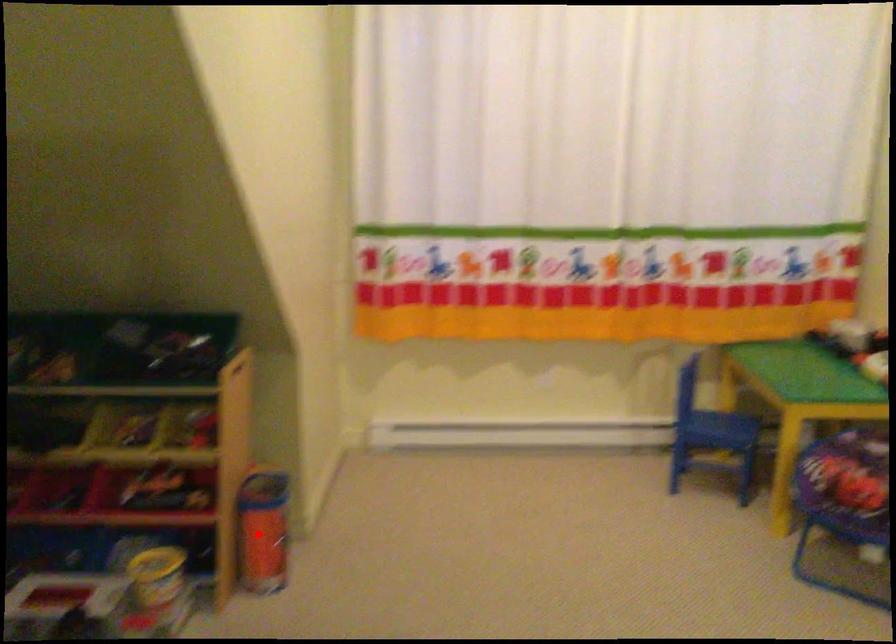
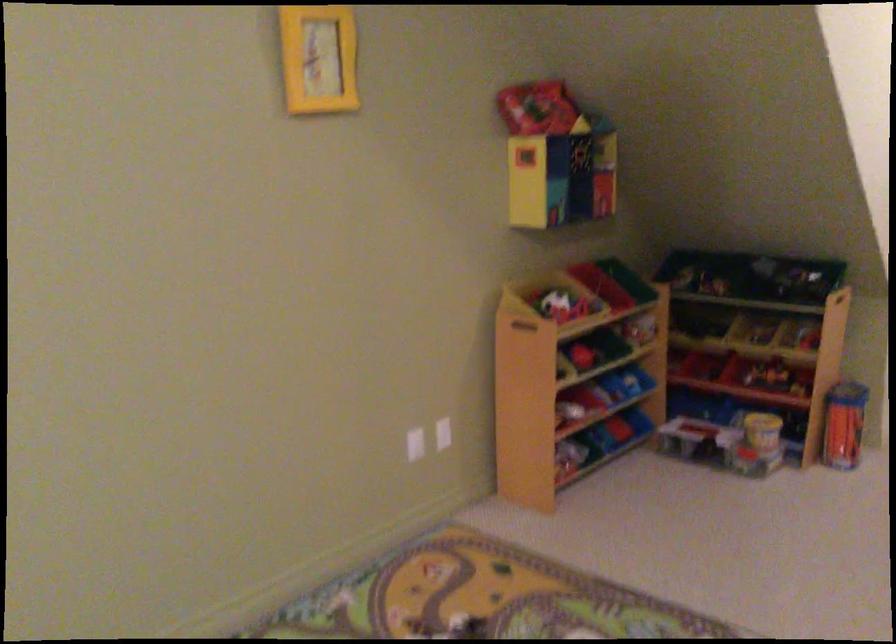
Question: I am providing you with two images of the same scene from different viewpoints. In image1, a red point is highlighted. Considering the same 3D point in image2, which of the following is correct?

Choices:
 (A) It is closer
 (B) It is farther

Answer: (B)